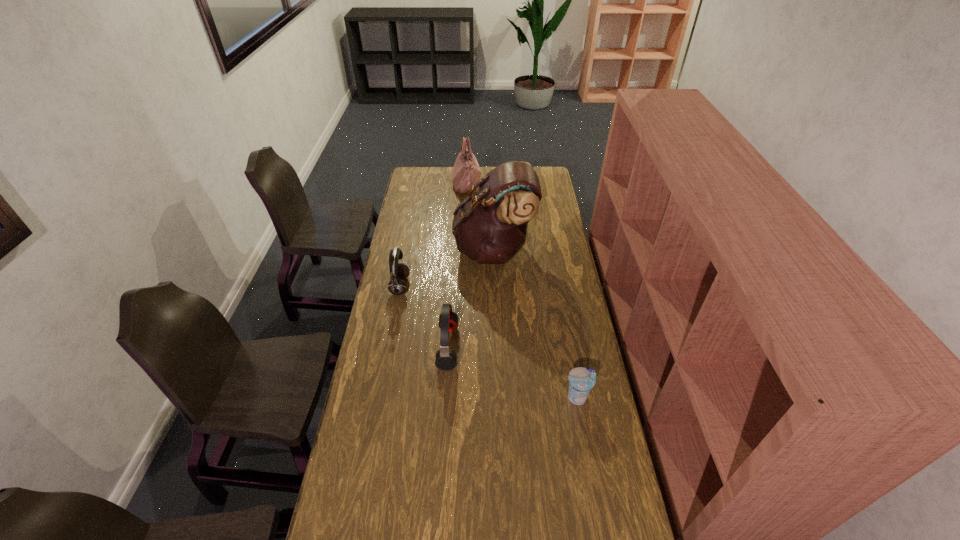
The height and width of the screenshot is (540, 960). Find the location of `vacant space situated at the front of the satchel with buckles`. vacant space situated at the front of the satchel with buckles is located at coordinates 435,249.

You are a GUI agent. You are given a task and a screenshot of the screen. Output one action in this format:
    pyautogui.click(x=<x>, y=<y>)
    Task: Click on the vacant space situated 0.290m at the front of the satchel with buckles
    
    Given the screenshot: What is the action you would take?
    pyautogui.click(x=396, y=249)

Locate an element on the screen. vacant space located at the front of the handbag with handles is located at coordinates (543, 185).

Image resolution: width=960 pixels, height=540 pixels. In order to click on free location located 0.270m on the ear pads of the left earphone in this screenshot , I will do (468, 287).

Where is `blank space located on the ear cups of the right earphone`? The height and width of the screenshot is (540, 960). blank space located on the ear cups of the right earphone is located at coordinates (506, 347).

Image resolution: width=960 pixels, height=540 pixels. In order to click on vacant space located on the back of the nearest object in this screenshot , I will do `click(574, 373)`.

Where is `object present at the far edge`? This screenshot has height=540, width=960. object present at the far edge is located at coordinates (466, 172).

The image size is (960, 540). What are the coordinates of `object positioned at the left edge` in the screenshot? It's located at (398, 271).

Image resolution: width=960 pixels, height=540 pixels. Identify the location of object present at the right edge. (581, 380).

Locate an element on the screen. vacant space at the left edge of the desktop is located at coordinates (431, 192).